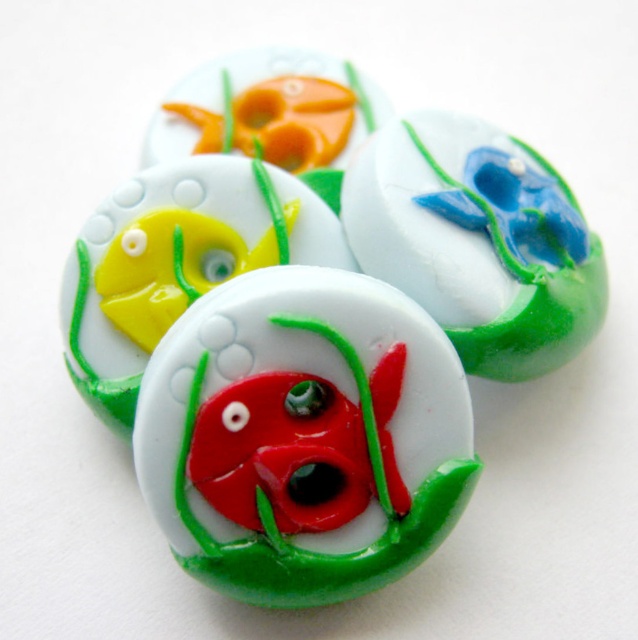
In the scene shown: Is glossy ceramic fish at center to the right of matte glass flower at upper right from the viewer's perspective?

No, glossy ceramic fish at center is not to the right of matte glass flower at upper right.

Can you confirm if glossy ceramic fish at center is wider than matte glass flower at upper right?

Correct, the width of glossy ceramic fish at center exceeds that of matte glass flower at upper right.

Is point (371, 388) farther from viewer compared to point (440, 164)?

No, it is in front of (440, 164).

I want to click on glossy ceramic fish at center, so click(302, 435).

Is matte glass flower at upper right closer to camera compared to matte orange fish at upper center?

Yes.

Between point (468, 323) and point (219, 150), which one is positioned in front?

Point (468, 323) is more forward.

Is point (553, 216) closer to camera compared to point (170, 152)?

Yes.

Where is `matte glass flower at upper right`? The height and width of the screenshot is (640, 638). matte glass flower at upper right is located at coordinates (477, 241).

Can you confirm if glossy ceramic fish at center is positioned to the left of matte glass fish at center?

Incorrect, glossy ceramic fish at center is not on the left side of matte glass fish at center.

Is point (216, 364) less distant than point (114, 353)?

Yes.

Locate an element on the screen. glossy ceramic fish at center is located at coordinates [302, 435].

Locate an element on the screen. Image resolution: width=638 pixels, height=640 pixels. glossy ceramic fish at center is located at coordinates (302, 435).